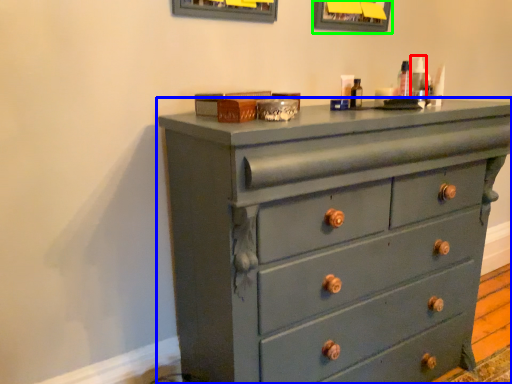
Question: Based on their relative distances, which object is farther from toiletry (highlighted by a red box)? Choose from chest of drawers (highlighted by a blue box) and picture frame (highlighted by a green box).

Choices:
 (A) chest of drawers
 (B) picture frame

Answer: (A)